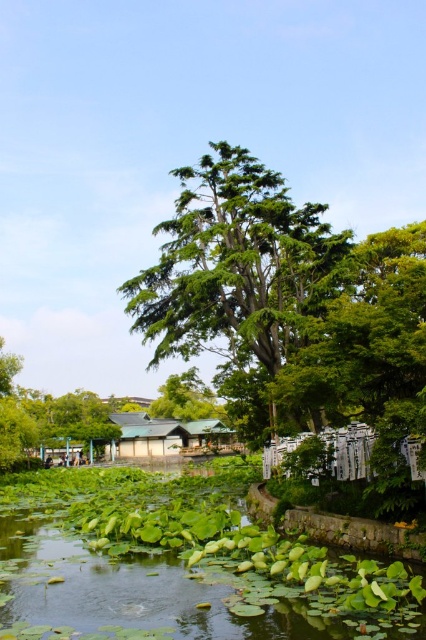
Consider the image. Between green needle-like leaves at center and green matte hut at center, which one is positioned lower?

green matte hut at center

Is point (241, 250) farther from camera compared to point (170, 440)?

No, (241, 250) is closer to viewer.

Where is `green needle-like leaves at center`? The width and height of the screenshot is (426, 640). green needle-like leaves at center is located at coordinates (236, 278).

Is green leafy water at lower left closer to camera compared to green matte hut at center?

Yes, green leafy water at lower left is in front of green matte hut at center.

Is point (273, 548) closer to camera compared to point (152, 456)?

Yes, point (273, 548) is in front of point (152, 456).

Between point (92, 584) and point (126, 458), which one is positioned behind?

The point (126, 458) is more distant.

Locate an element on the screen. The width and height of the screenshot is (426, 640). green leafy water at lower left is located at coordinates (181, 568).

Is point (422, 288) behind point (199, 422)?

No, (422, 288) is closer to viewer.

Is green leafy tree at right closer to camera compared to green matte hut at center?

Yes, it is.

Which is in front, point (287, 497) or point (178, 426)?

Point (287, 497)

Locate an element on the screen. The width and height of the screenshot is (426, 640). green leafy tree at right is located at coordinates (365, 378).